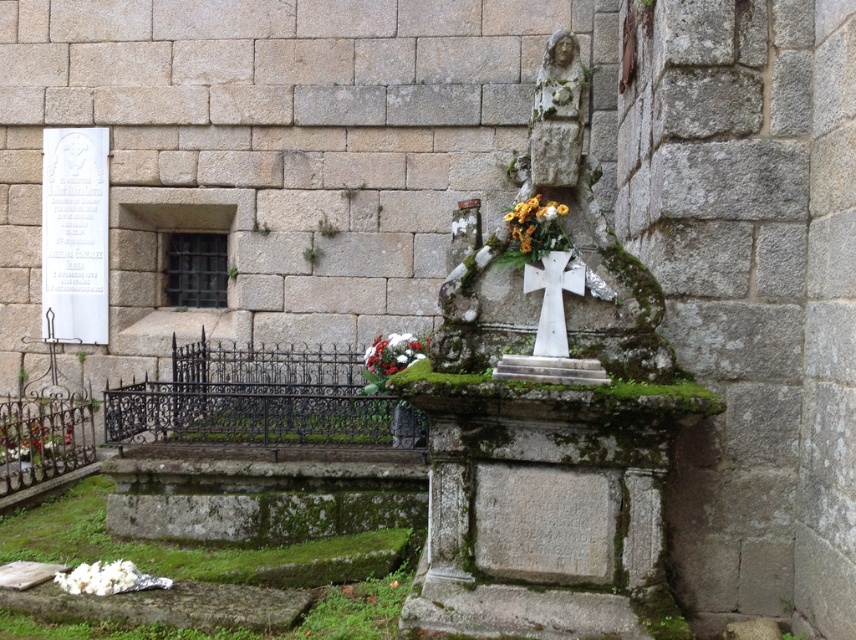
Does point (601, 273) lie behind point (372, 348)?

No, (601, 273) is closer to viewer.

Does point (548, 412) come in front of point (393, 344)?

Yes.

Identify the location of stone statue at center. (548, 420).

Does white stone cross at center appear over white floral bouquet at lower left?

Yes.

Does white stone cross at center appear under white floral bouquet at lower left?

Actually, white stone cross at center is above white floral bouquet at lower left.

What do you see at coordinates (553, 300) in the screenshot? The width and height of the screenshot is (856, 640). I see `white stone cross at center` at bounding box center [553, 300].

Locate an element on the screen. Image resolution: width=856 pixels, height=640 pixels. white stone cross at center is located at coordinates (553, 300).

Who is shorter, stone statue at center or white stone cross at center?

Standing shorter between the two is white stone cross at center.

Does point (539, 260) come in front of point (548, 269)?

No, (539, 260) is behind (548, 269).

Find the location of a particular element. This screenshot has height=640, width=856. stone statue at center is located at coordinates (548, 420).